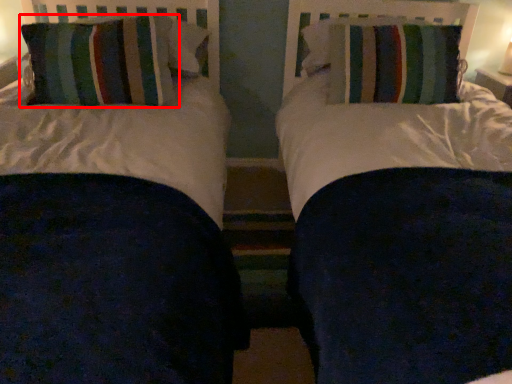
Question: From the image's perspective, where is pillow (annotated by the red box) located in relation to pillow in the image?

Choices:
 (A) above
 (B) below

Answer: (B)